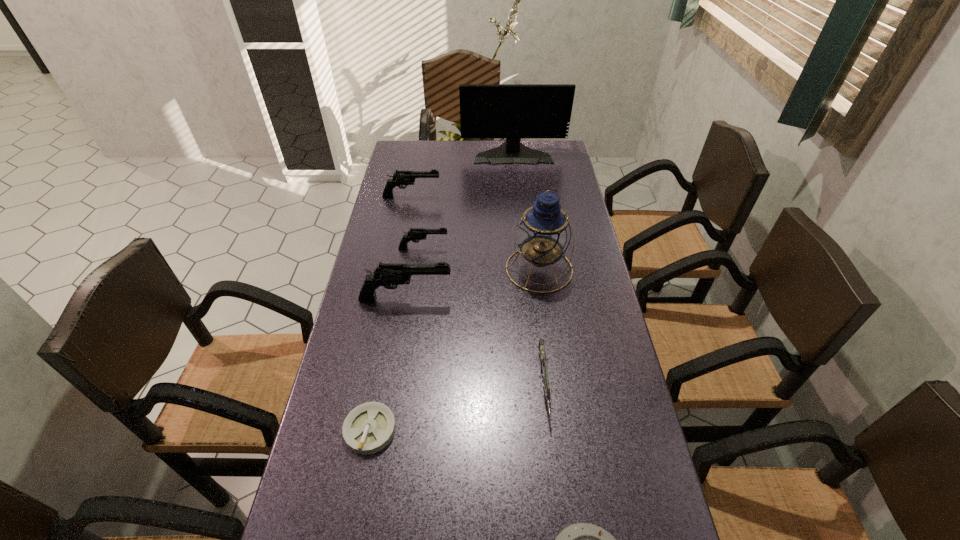
Identify the location of the farthest object. This screenshot has width=960, height=540. (513, 111).

Where is `lantern`? The image size is (960, 540). lantern is located at coordinates (543, 234).

Locate an element on the screen. Image resolution: width=960 pixels, height=540 pixels. the biggest black gun is located at coordinates (389, 275).

You are a GUI agent. You are given a task and a screenshot of the screen. Output one action in this format:
    pyautogui.click(x=<x>, y=<y>)
    Task: Click on the nearest black gun
    Image resolution: width=960 pixels, height=540 pixels.
    Given the screenshot: What is the action you would take?
    pyautogui.click(x=389, y=275)

The width and height of the screenshot is (960, 540). What are the coordinates of `the fifth shortest object` in the screenshot? It's located at (401, 177).

Image resolution: width=960 pixels, height=540 pixels. Find the location of `the second tallest gun`. the second tallest gun is located at coordinates (401, 177).

What are the coordinates of `the smallest black gun` in the screenshot? It's located at (414, 234).

Image resolution: width=960 pixels, height=540 pixels. Find the location of `the second nearest black gun`. the second nearest black gun is located at coordinates (414, 234).

At what (x,y) coordinates should I click in order to perform the action: click on the nearest gun. Please return your answer as a coordinate pair (x, y). The height and width of the screenshot is (540, 960). Looking at the image, I should click on (543, 361).

Image resolution: width=960 pixels, height=540 pixels. Find the location of `the rightmost gun`. the rightmost gun is located at coordinates (543, 361).